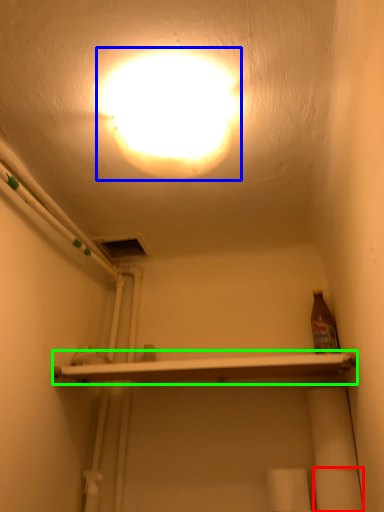
Question: Based on their relative distances, which object is farther from toilet paper (highlighted by a red box)? Choose from lamp (highlighted by a blue box) and shelf (highlighted by a green box).

Choices:
 (A) lamp
 (B) shelf

Answer: (A)